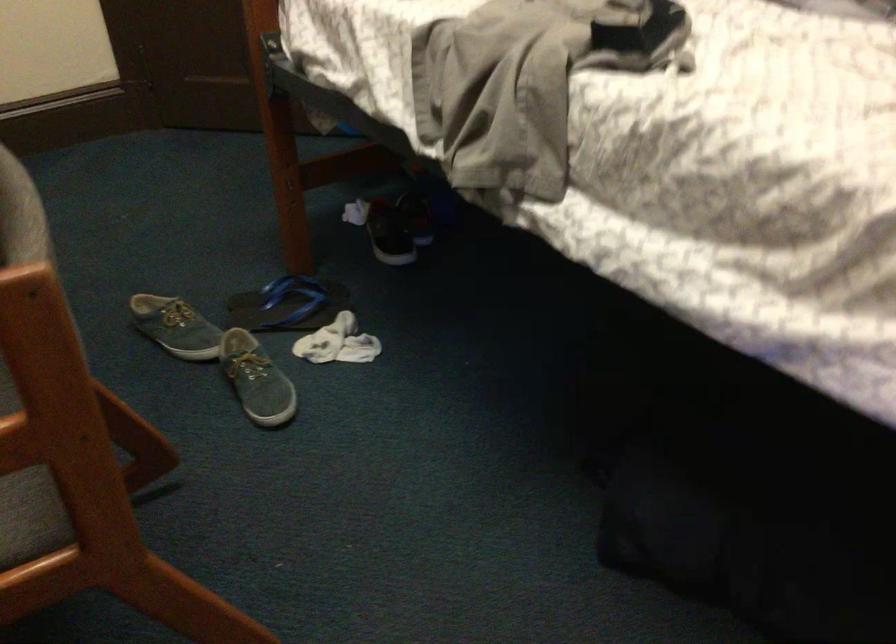
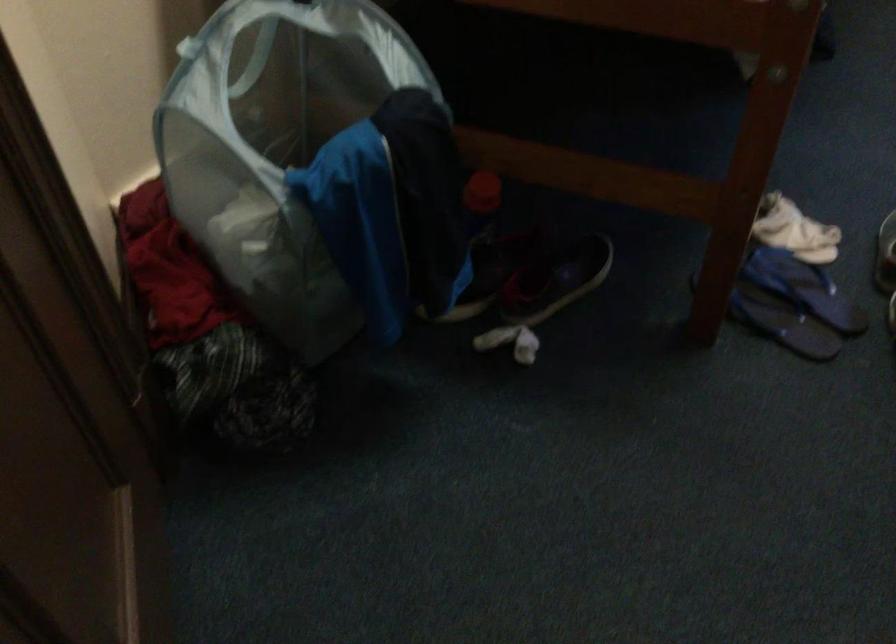
Locate, in the second image, the point that corresponds to pixel 264 296 in the first image.

(782, 323)